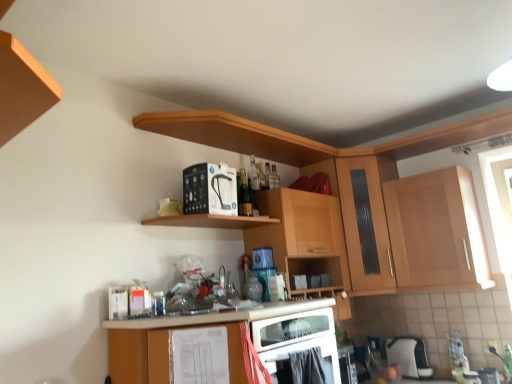
Question: Which direction should I rotate to face black plastic water filter at upper center, which is the first appliance in top-to-bottom order, — up or down?

Choices:
 (A) down
 (B) up

Answer: (B)

Question: Does wooden at upper center, placed as the 2th shelf when sorted from bottom to top, have a lesser width compared to matte wood cabinet at lower center, acting as the 3th cabinetry starting from the right?

Choices:
 (A) no
 (B) yes

Answer: (B)

Question: Considering the relative sizes of wooden at upper center, which is the first shelf from top to bottom, and matte wood cabinet at lower center, acting as the first cabinetry starting from the left, in the image provided, is wooden at upper center, which is the first shelf from top to bottom, bigger than matte wood cabinet at lower center, acting as the first cabinetry starting from the left,?

Choices:
 (A) yes
 (B) no

Answer: (B)

Question: Is wooden at upper center, which is the first shelf from top to bottom, facing away from matte wood cabinet at lower center, acting as the first cabinetry starting from the left?

Choices:
 (A) no
 (B) yes

Answer: (A)

Question: Is wooden at upper center, which is the first shelf from top to bottom, smaller than matte wood cabinet at lower center, acting as the first cabinetry starting from the left?

Choices:
 (A) no
 (B) yes

Answer: (B)

Question: Can you confirm if wooden at upper center, placed as the 2th shelf when sorted from bottom to top, is positioned to the right of matte wood cabinet at lower center, acting as the first cabinetry starting from the left?

Choices:
 (A) no
 (B) yes

Answer: (B)

Question: Does wooden at upper center, placed as the 2th shelf when sorted from bottom to top, appear on the left side of matte wood cabinet at lower center, acting as the 3th cabinetry starting from the right?

Choices:
 (A) yes
 (B) no

Answer: (B)

Question: Considering the relative sizes of wooden at upper center, placed as the 2th shelf when sorted from bottom to top, and wooden cabinet at upper center, arranged as the 2th cabinetry when viewed from the right, in the image provided, is wooden at upper center, placed as the 2th shelf when sorted from bottom to top, wider than wooden cabinet at upper center, arranged as the 2th cabinetry when viewed from the right,?

Choices:
 (A) no
 (B) yes

Answer: (B)

Question: Considering the relative sizes of wooden at upper center, which is the first shelf from top to bottom, and wooden cabinet at upper center, arranged as the second cabinetry when viewed from the left, in the image provided, is wooden at upper center, which is the first shelf from top to bottom, taller than wooden cabinet at upper center, arranged as the second cabinetry when viewed from the left,?

Choices:
 (A) no
 (B) yes

Answer: (A)

Question: From a real-world perspective, is wooden at upper center, which is the first shelf from top to bottom, on wooden cabinet at upper center, arranged as the second cabinetry when viewed from the left?

Choices:
 (A) no
 (B) yes

Answer: (B)

Question: Can you confirm if wooden at upper center, placed as the 2th shelf when sorted from bottom to top, is shorter than wooden cabinet at upper center, arranged as the 2th cabinetry when viewed from the right?

Choices:
 (A) yes
 (B) no

Answer: (A)

Question: Does wooden at upper center, which is the first shelf from top to bottom, have a lesser width compared to wooden cabinet at upper center, arranged as the second cabinetry when viewed from the left?

Choices:
 (A) no
 (B) yes

Answer: (A)

Question: Is wooden at upper center, placed as the 2th shelf when sorted from bottom to top, not inside wooden cabinet at upper center, arranged as the 2th cabinetry when viewed from the right?

Choices:
 (A) no
 (B) yes

Answer: (B)

Question: Is wooden cabinet at upper center, arranged as the second cabinetry when viewed from the left, to the left of black plastic water filter at upper center, acting as the first appliance starting from the front, from the viewer's perspective?

Choices:
 (A) yes
 (B) no

Answer: (B)